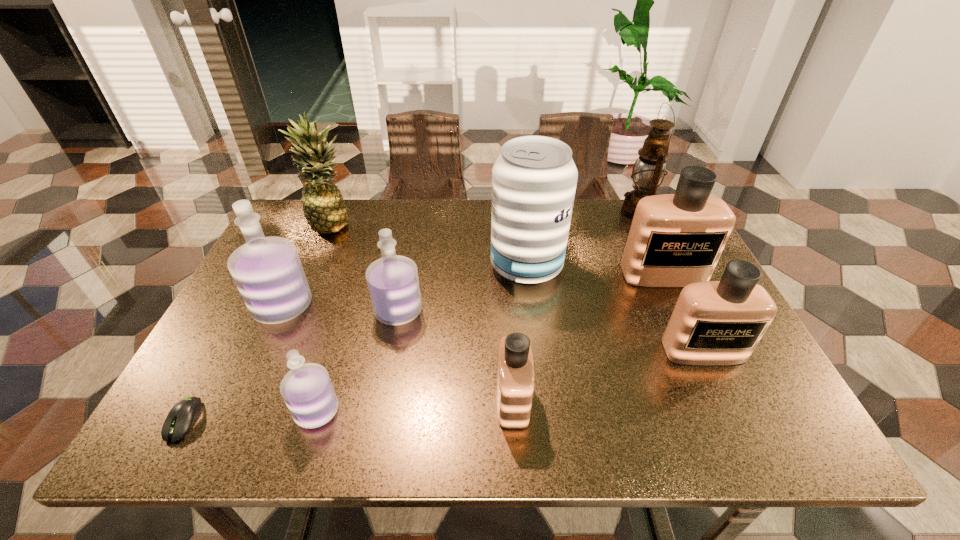
Image resolution: width=960 pixels, height=540 pixels. What are the coordinates of `free location that satisfies the following two spatial constraints: 1. on the front label of the smallest beige perfume; 2. on the wheel side of the shortest object` in the screenshot? It's located at (x=514, y=421).

The image size is (960, 540). I want to click on free space that satisfies the following two spatial constraints: 1. on the back side of the oil lamp; 2. on the left side of the pineapple, so coord(338,212).